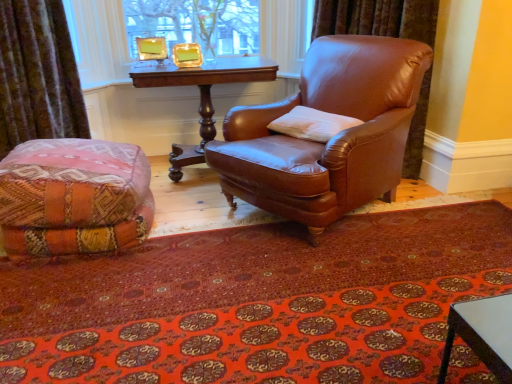
The image size is (512, 384). I want to click on multicolored woven ottoman at lower left, so click(74, 198).

Find the location of a particular element. white soft pillow at center is located at coordinates (312, 124).

Identify the location of mahogany wood table at center. (202, 95).

In order to face mahogany wood table at center, should I rotate leftwards or rightwards?

To align with it, rotate left about 6.666°.

The height and width of the screenshot is (384, 512). What are the coordinates of `gold-framed picture at upper center` in the screenshot? It's located at [x=196, y=24].

From a real-world perspective, between gold-framed picture at upper center and mahogany wood table at center, who is vertically higher?

gold-framed picture at upper center, from a real-world perspective.

From the image's perspective, relative to mahogany wood table at center, is gold-framed picture at upper center above or below?

gold-framed picture at upper center is above mahogany wood table at center.

Is gold-framed picture at upper center not near mahogany wood table at center?

No, there isn't a large distance between gold-framed picture at upper center and mahogany wood table at center.

Is mahogany wood table at center completely or partially inside gold-framed picture at upper center?

Actually, mahogany wood table at center is outside gold-framed picture at upper center.

Is point (110, 178) closer or farther from the camera than point (304, 96)?

Point (110, 178).

Which object is further away from the camera taking this photo, multicolored woven ottoman at lower left or brown leather chair at center?

multicolored woven ottoman at lower left is more distant.

Who is smaller, multicolored woven ottoman at lower left or brown leather chair at center?

multicolored woven ottoman at lower left is smaller.

Does multicolored woven ottoman at lower left appear on the right side of brown leather chair at center?

No, multicolored woven ottoman at lower left is not to the right of brown leather chair at center.

The height and width of the screenshot is (384, 512). Find the location of `mat that appears on the right of velvet brown curtain at lower left`. mat that appears on the right of velvet brown curtain at lower left is located at coordinates (258, 302).

Which of these two, velvet brown curtain at lower left or carpeted mat at lower center, stands shorter?

carpeted mat at lower center.

Is carpeted mat at lower center at the back of velvet brown curtain at lower left?

That's not correct — velvet brown curtain at lower left is not looking away from carpeted mat at lower center.

Can you confirm if velvet brown curtain at lower left is wider than carpeted mat at lower center?

In fact, velvet brown curtain at lower left might be narrower than carpeted mat at lower center.

Can we say mahogany wood table at center lies outside velvet brown curtain at lower left?

Yes, mahogany wood table at center is located beyond the bounds of velvet brown curtain at lower left.

From the picture: Is mahogany wood table at center to the left of velvet brown curtain at lower left from the viewer's perspective?

No, mahogany wood table at center is not to the left of velvet brown curtain at lower left.

From the image's perspective, is mahogany wood table at center under velvet brown curtain at lower left?

Indeed, from the image's perspective, mahogany wood table at center is shown beneath velvet brown curtain at lower left.

Consider the image. Can you confirm if white soft pillow at center is positioned to the right of brown leather chair at center?

Incorrect, white soft pillow at center is not on the right side of brown leather chair at center.

Are white soft pillow at center and brown leather chair at center far apart?

No.

Does white soft pillow at center come in front of brown leather chair at center?

No.

Considering the positions of point (315, 125) and point (377, 113), is point (315, 125) closer or farther from the camera than point (377, 113)?

Point (315, 125) is farther from the camera than point (377, 113).

What are the coordinates of `curtain above the carpeted mat at lower center (from the image's perspective)` in the screenshot? It's located at (38, 75).

In the image, is carpeted mat at lower center positioned in front of or behind velvet brown curtain at lower left?

carpeted mat at lower center is positioned closer to the viewer than velvet brown curtain at lower left.

Looking at the image, does carpeted mat at lower center seem bigger or smaller compared to velvet brown curtain at lower left?

Considering their sizes, carpeted mat at lower center takes up more space than velvet brown curtain at lower left.

Can velvet brown curtain at lower left be found inside carpeted mat at lower center?

That's incorrect, velvet brown curtain at lower left is not inside carpeted mat at lower center.

Could you tell me if multicolored woven ottoman at lower left is facing white soft pillow at center?

No, multicolored woven ottoman at lower left is not oriented towards white soft pillow at center.

Consider the image. Considering the relative sizes of multicolored woven ottoman at lower left and white soft pillow at center in the image provided, is multicolored woven ottoman at lower left bigger than white soft pillow at center?

Correct, multicolored woven ottoman at lower left is larger in size than white soft pillow at center.

Considering the sizes of objects multicolored woven ottoman at lower left and white soft pillow at center in the image provided, who is shorter, multicolored woven ottoman at lower left or white soft pillow at center?

With less height is white soft pillow at center.

The height and width of the screenshot is (384, 512). I want to click on bay window that appears above the mahogany wood table at center (from a real-world perspective), so click(196, 24).

Where is `chair lying on the right of multicolored woven ottoman at lower left`? Image resolution: width=512 pixels, height=384 pixels. chair lying on the right of multicolored woven ottoman at lower left is located at coordinates (331, 139).

When comparing their distances from carpeted mat at lower center, does mahogany wood table at center or multicolored woven ottoman at lower left seem further?

mahogany wood table at center lies further to carpeted mat at lower center than the other object.

When comparing their distances from multicolored woven ottoman at lower left, does mahogany wood table at center or brown leather chair at center seem closer?

Based on the image, brown leather chair at center appears to be nearer to multicolored woven ottoman at lower left.

Estimate the real-world distances between objects in this image. Which object is further from velvet brown curtain at lower left, mahogany wood table at center or carpeted mat at lower center?

The object further to velvet brown curtain at lower left is carpeted mat at lower center.

Which object lies further to the anchor point brown leather chair at center, gold-framed picture at upper center or multicolored woven ottoman at lower left?

Based on the image, gold-framed picture at upper center appears to be further to brown leather chair at center.

Based on the photo, based on their spatial positions, is carpeted mat at lower center or velvet brown curtain at lower left closer to white soft pillow at center?

Based on the image, carpeted mat at lower center appears to be nearer to white soft pillow at center.

From the image, which object appears to be nearer to velvet brown curtain at lower left, multicolored woven ottoman at lower left or gold-framed picture at upper center?

Among the two, multicolored woven ottoman at lower left is located nearer to velvet brown curtain at lower left.

When comparing their distances from brown leather chair at center, does mahogany wood table at center or gold-framed picture at upper center seem closer?

mahogany wood table at center lies closer to brown leather chair at center than the other object.

Looking at the image, which one is located further to multicolored woven ottoman at lower left, brown leather chair at center or gold-framed picture at upper center?

gold-framed picture at upper center is positioned further to the anchor multicolored woven ottoman at lower left.

In order to click on chair between carpeted mat at lower center and mahogany wood table at center from front to back in this screenshot , I will do `click(331, 139)`.

At what (x,y) coordinates should I click in order to perform the action: click on mat between multicolored woven ottoman at lower left and white soft pillow at center. Please return your answer as a coordinate pair (x, y). The height and width of the screenshot is (384, 512). Looking at the image, I should click on (258, 302).

Where is `bay window between velvet brown curtain at lower left and brown leather chair at center from left to right`? bay window between velvet brown curtain at lower left and brown leather chair at center from left to right is located at coordinates (196, 24).

What are the coordinates of `couch located between velvet brown curtain at lower left and mahogany wood table at center in the left-right direction` in the screenshot? It's located at (74, 198).